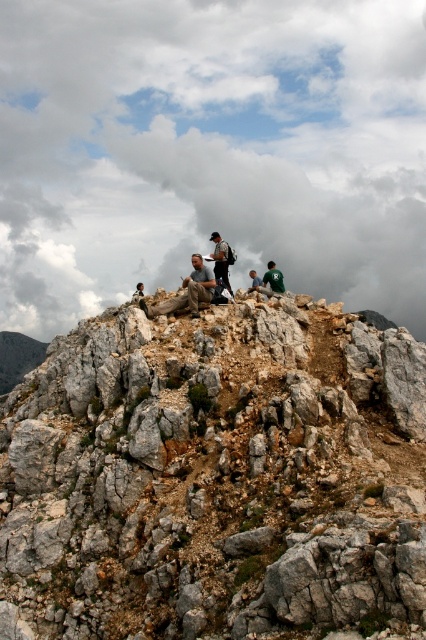
Question: Which is nearer to the dark green t-shirt at center?

Choices:
 (A) cloudy sky at upper center
 (B) gray rough rock at center
 (C) green jersey at center

Answer: (B)

Question: Which point appears farthest from the camera in this image?

Choices:
 (A) (135, 294)
 (B) (253, 285)

Answer: (B)

Question: Is green jersey at center to the left of dark green t-shirt at center from the viewer's perspective?

Choices:
 (A) no
 (B) yes

Answer: (A)

Question: Is the position of gray rough rock at center more distant than that of green jersey at center?

Choices:
 (A) no
 (B) yes

Answer: (A)

Question: Based on their relative distances, which object is nearer to the green jersey at center?

Choices:
 (A) gray rough rock at center
 (B) matte gray rock at center
 (C) green fabric jacket at center

Answer: (C)

Question: Does matte gray rock at center have a greater width compared to green jersey at center?

Choices:
 (A) no
 (B) yes

Answer: (A)